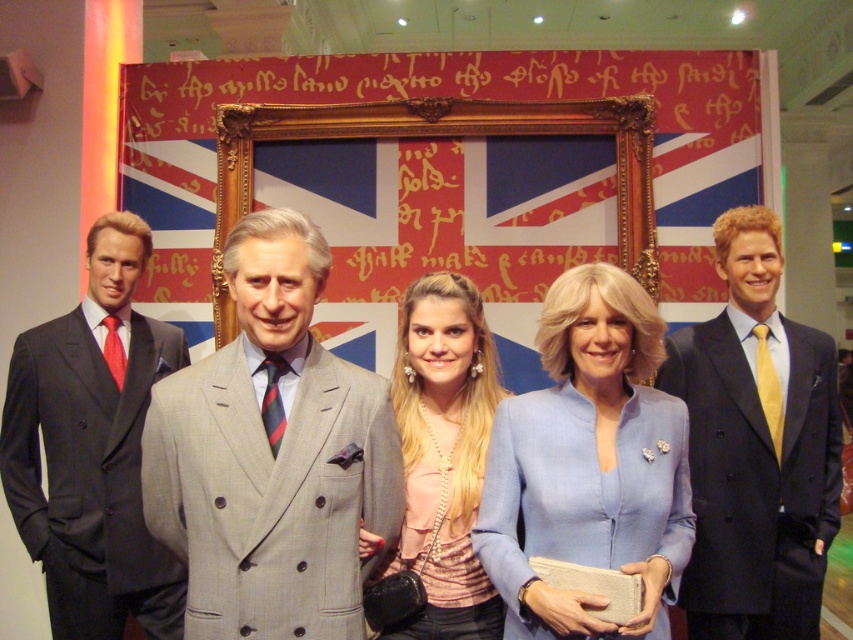
Is light blue fabric jacket at center to the right of matte black suit at left from the viewer's perspective?

Yes, light blue fabric jacket at center is to the right of matte black suit at left.

Between light blue fabric jacket at center and matte black suit at left, which one has less height?

light blue fabric jacket at center

Who is more distant from viewer, (665, 563) or (71, 582)?

The point (71, 582) is more distant.

Identify the location of light blue fabric jacket at center. (589, 465).

Between light blue fabric jacket at center and pearl necklace at center, which one has more height?

With more height is pearl necklace at center.

Locate an element on the screen. The image size is (853, 640). light blue fabric jacket at center is located at coordinates [x=589, y=465].

Which is behind, point (688, 506) or point (393, 637)?

Positioned behind is point (393, 637).

What are the coordinates of `light blue fabric jacket at center` in the screenshot? It's located at (589, 465).

From the picture: Is dark blue suit at right bigger than goldwooden frame at center?

No.

Can you confirm if dark blue suit at right is positioned to the right of goldwooden frame at center?

Correct, you'll find dark blue suit at right to the right of goldwooden frame at center.

Is point (762, 502) positioned behind point (636, 164)?

No.

Locate an element on the screen. The width and height of the screenshot is (853, 640). dark blue suit at right is located at coordinates (756, 448).